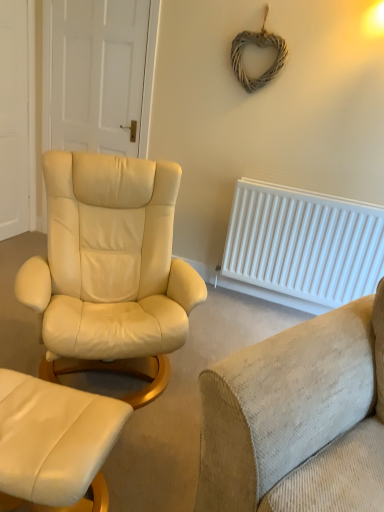
Question: Would you say white plastic radiator at right contains white matte door at upper left, which is the 1th door in right-to-left order?

Choices:
 (A) no
 (B) yes

Answer: (A)

Question: Considering the relative positions of white plastic radiator at right and white matte door at upper left, which is the 1th door in right-to-left order, in the image provided, is white plastic radiator at right behind white matte door at upper left, which is the 1th door in right-to-left order,?

Choices:
 (A) no
 (B) yes

Answer: (A)

Question: From the image's perspective, is white plastic radiator at right under white matte door at upper left, which is the 1th door in right-to-left order?

Choices:
 (A) no
 (B) yes

Answer: (B)

Question: Can you confirm if white plastic radiator at right is thinner than white matte door at upper left, which is the 1th door in right-to-left order?

Choices:
 (A) yes
 (B) no

Answer: (B)

Question: Is white matte door at upper left, arranged as the second door when viewed from the left, at the back of white plastic radiator at right?

Choices:
 (A) yes
 (B) no

Answer: (B)

Question: From a real-world perspective, is white plastic radiator at right located higher than white matte door at upper left, which is the 1th door in right-to-left order?

Choices:
 (A) no
 (B) yes

Answer: (A)

Question: Is beige corduroy couch at lower right far from white plastic radiator at right?

Choices:
 (A) yes
 (B) no

Answer: (A)

Question: Does beige corduroy couch at lower right have a smaller size compared to white plastic radiator at right?

Choices:
 (A) no
 (B) yes

Answer: (A)

Question: Can we say beige corduroy couch at lower right lies outside white plastic radiator at right?

Choices:
 (A) yes
 (B) no

Answer: (A)

Question: Can you confirm if beige corduroy couch at lower right is shorter than white plastic radiator at right?

Choices:
 (A) no
 (B) yes

Answer: (B)

Question: From the image's perspective, is beige corduroy couch at lower right beneath white plastic radiator at right?

Choices:
 (A) yes
 (B) no

Answer: (A)

Question: Can white plastic radiator at right be found inside beige corduroy couch at lower right?

Choices:
 (A) yes
 (B) no

Answer: (B)

Question: Is white matte door at upper left, arranged as the second door when viewed from the left, at the right side of white wooden door at left, acting as the second door starting from the right?

Choices:
 (A) yes
 (B) no

Answer: (A)